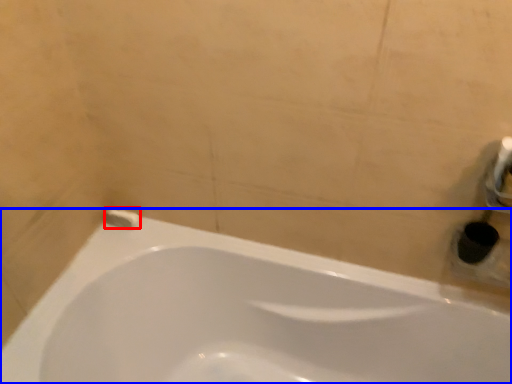
Question: Among these objects, which one is farthest to the camera, toilet paper (highlighted by a red box) or bathtub (highlighted by a blue box)?

Choices:
 (A) toilet paper
 (B) bathtub

Answer: (A)